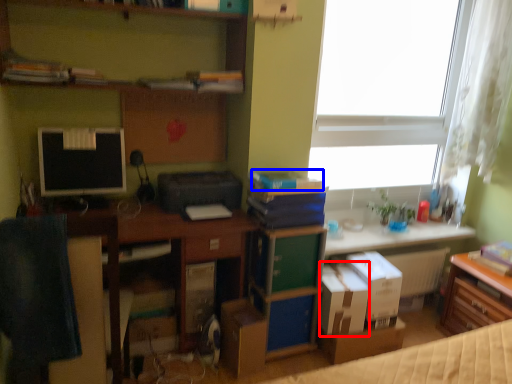
Question: Which object is further to the camera taking this photo, cardboard box (highlighted by a red box) or book (highlighted by a blue box)?

Choices:
 (A) cardboard box
 (B) book

Answer: (A)